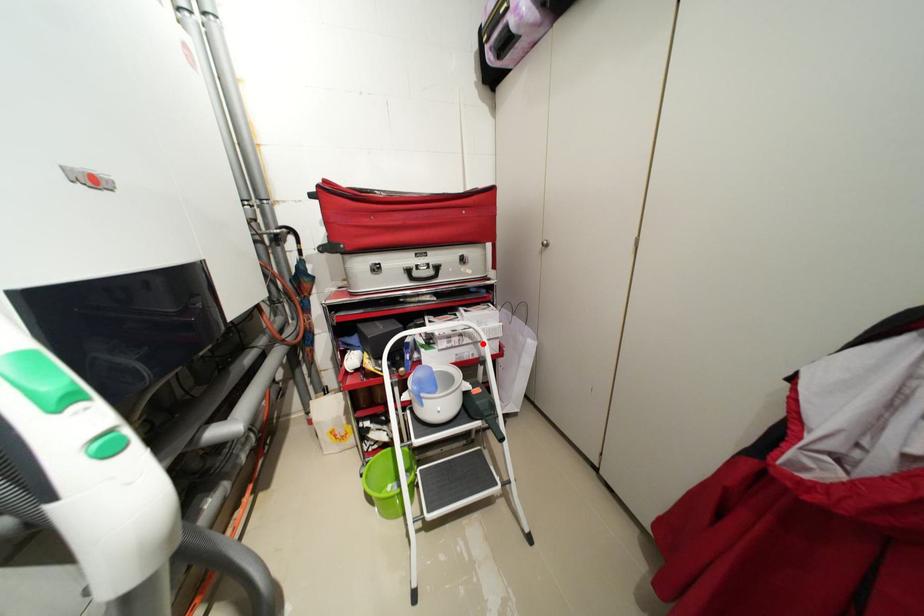
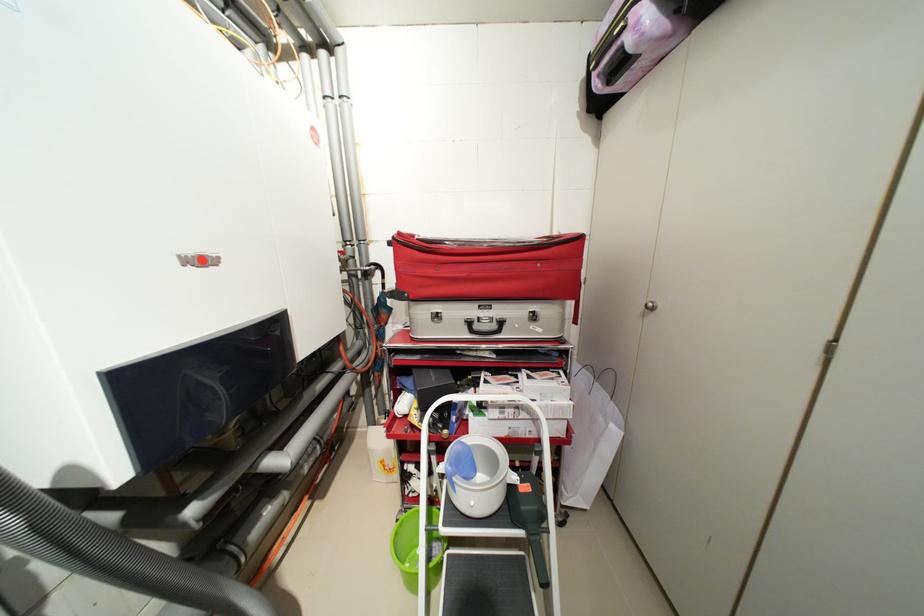
In the second image, find the point that corresponds to the highlighted location in the first image.

(541, 421)